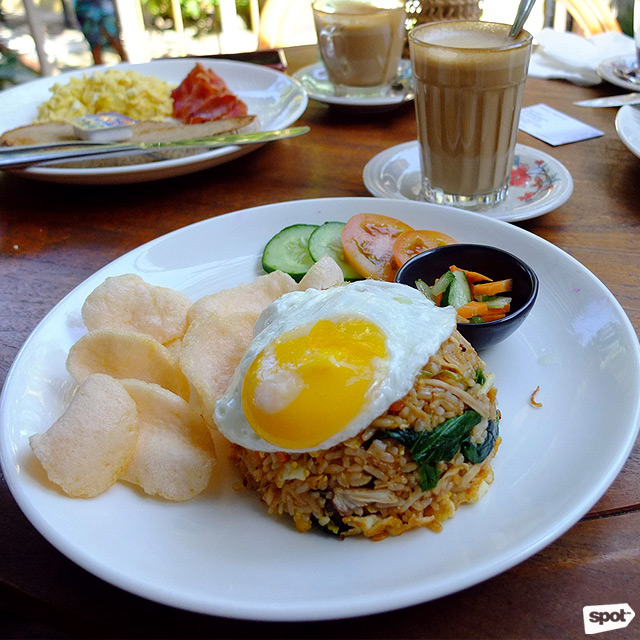
This screenshot has width=640, height=640. I want to click on small black bowl, so click(521, 298), click(498, 262), click(424, 269), click(479, 310), click(476, 291), click(475, 260), click(502, 324).